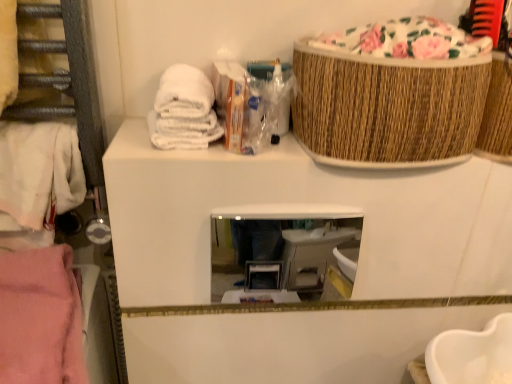
Question: Does pink fabric at left, the second clothing viewed from the top, have a larger size compared to clear glass mirror at center?

Choices:
 (A) no
 (B) yes

Answer: (B)

Question: Is pink fabric at left, which is the 1th clothing in bottom-to-top order, smaller than clear glass mirror at center?

Choices:
 (A) yes
 (B) no

Answer: (B)

Question: Is pink fabric at left, which is the 1th clothing in bottom-to-top order, directly adjacent to clear glass mirror at center?

Choices:
 (A) no
 (B) yes

Answer: (A)

Question: Does pink fabric at left, the second clothing viewed from the top, lie in front of clear glass mirror at center?

Choices:
 (A) yes
 (B) no

Answer: (A)

Question: Can we say pink fabric at left, the second clothing viewed from the top, lies outside clear glass mirror at center?

Choices:
 (A) no
 (B) yes

Answer: (B)

Question: From a real-world perspective, is pink fabric at left, which is the 1th clothing in bottom-to-top order, positioned under clear glass mirror at center based on gravity?

Choices:
 (A) yes
 (B) no

Answer: (A)

Question: From a real-world perspective, is white cotton towel at left, the second clothing when ordered from bottom to top, over woven brown basket at upper right?

Choices:
 (A) yes
 (B) no

Answer: (B)

Question: Is white cotton towel at left, the second clothing when ordered from bottom to top, aimed at woven brown basket at upper right?

Choices:
 (A) yes
 (B) no

Answer: (B)

Question: Are white cotton towel at left, the second clothing when ordered from bottom to top, and woven brown basket at upper right far apart?

Choices:
 (A) yes
 (B) no

Answer: (B)

Question: Does white cotton towel at left, which appears as the 1th clothing when viewed from the top, lie in front of woven brown basket at upper right?

Choices:
 (A) no
 (B) yes

Answer: (A)

Question: Does white cotton towel at left, which appears as the 1th clothing when viewed from the top, have a lesser height compared to woven brown basket at upper right?

Choices:
 (A) no
 (B) yes

Answer: (A)

Question: Is white cotton towel at left, which appears as the 1th clothing when viewed from the top, taller than woven brown basket at upper right?

Choices:
 (A) yes
 (B) no

Answer: (A)

Question: From the image's perspective, is clear glass mirror at center over pink fabric at left, the second clothing viewed from the top?

Choices:
 (A) yes
 (B) no

Answer: (A)